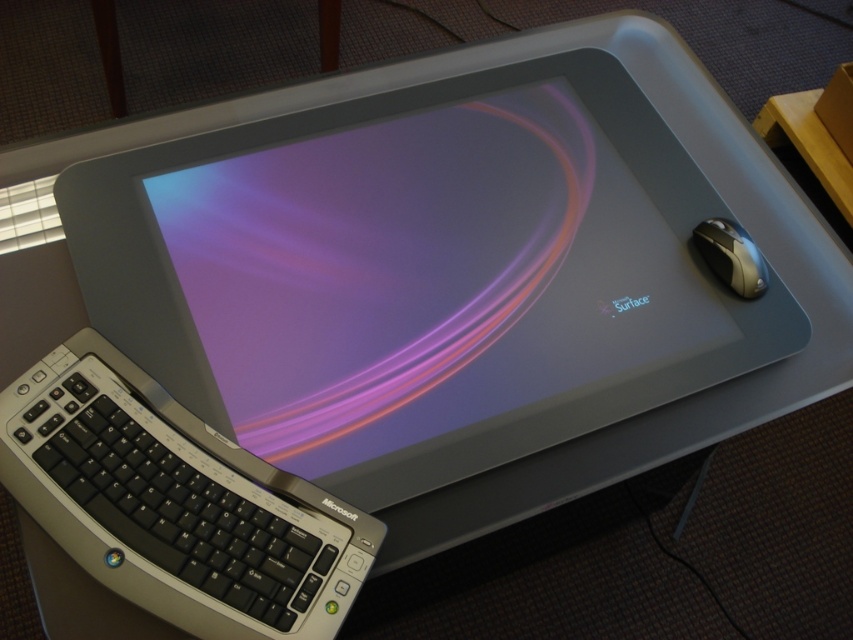
Question: Where is black plastic keyboard at lower left located in relation to silver metallic mouse at right in the image?

Choices:
 (A) below
 (B) above

Answer: (A)

Question: Which point is closer to the camera taking this photo?

Choices:
 (A) (715, 225)
 (B) (134, 548)

Answer: (B)

Question: In this image, where is black plastic keyboard at lower left located relative to silver metallic mouse at right?

Choices:
 (A) right
 (B) left

Answer: (B)

Question: Is black plastic keyboard at lower left thinner than silver metallic mouse at right?

Choices:
 (A) yes
 (B) no

Answer: (B)

Question: Which point is farther to the camera?

Choices:
 (A) black plastic keyboard at lower left
 (B) silver metallic mouse at right

Answer: (B)